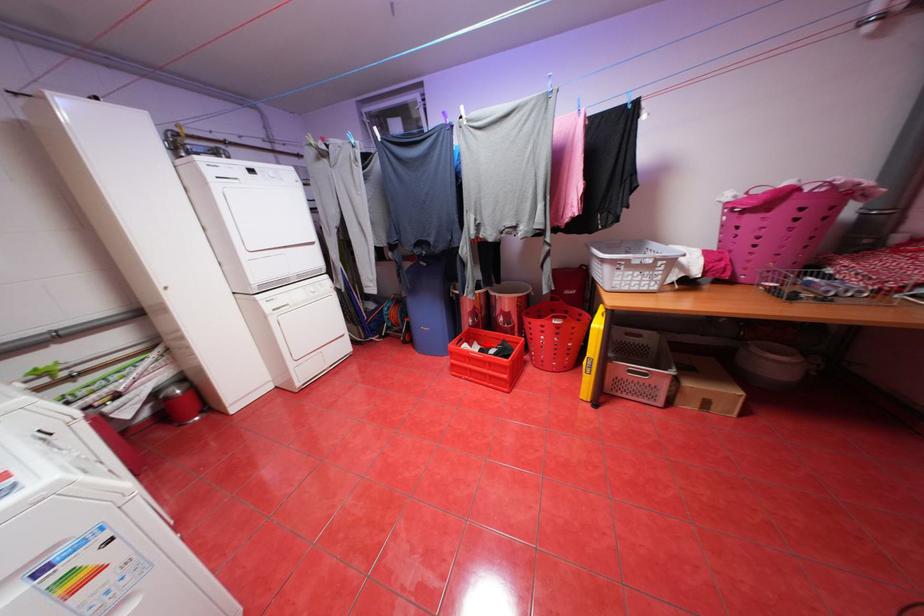
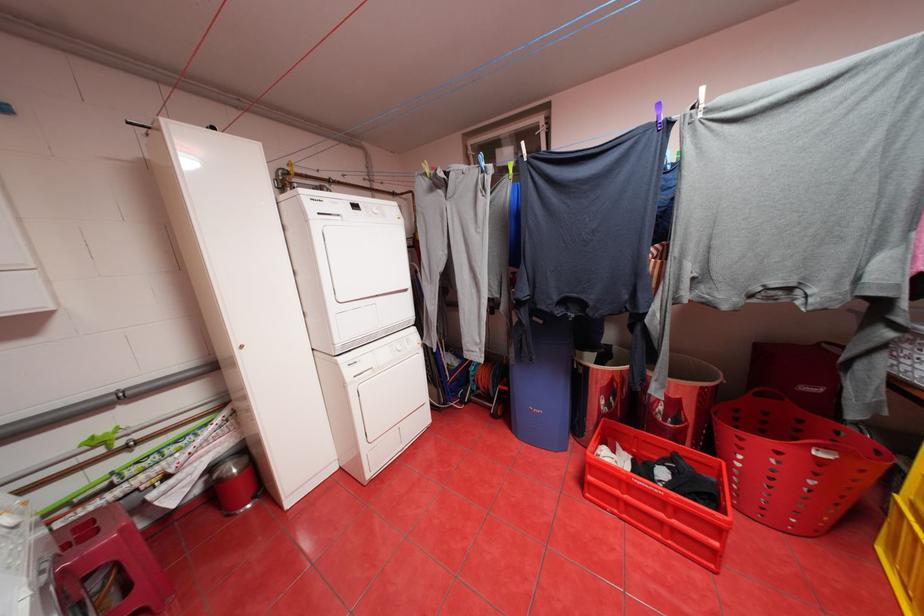
In the second image, find the point that corresponds to the highlighted location in the first image.

(631, 448)